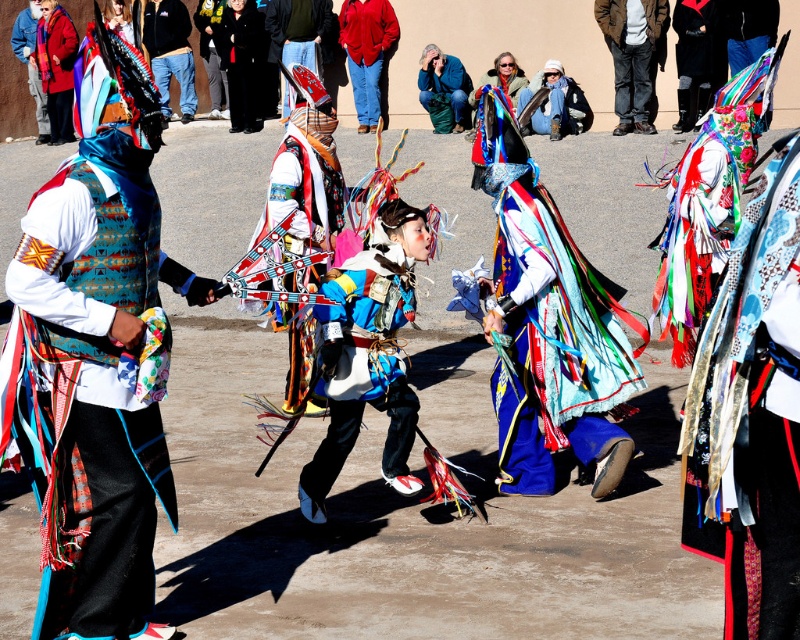
Question: Can you confirm if matte blue vest at left is positioned to the left of multicolored fabric costume at center?

Choices:
 (A) yes
 (B) no

Answer: (A)

Question: Can you confirm if velvet black coat at upper right is smaller than matte black jacket at upper left?

Choices:
 (A) yes
 (B) no

Answer: (B)

Question: Is embroidered silk dress at right thinner than matte black pants at center?

Choices:
 (A) no
 (B) yes

Answer: (B)

Question: Which point is farther from the camera taking this photo?

Choices:
 (A) (370, 3)
 (B) (738, 440)

Answer: (A)

Question: Considering the real-world distances, which object is closest to the denim jacket at center?

Choices:
 (A) blue satin dress at center
 (B) embroidered silk dress at right
 (C) blue denim jeans at center

Answer: (A)

Question: Which object appears farthest from the camera in this image?

Choices:
 (A) black wool coat at center
 (B) matte black shoes at center
 (C) blue satin dress at center
 (D) denim jacket at center

Answer: (A)